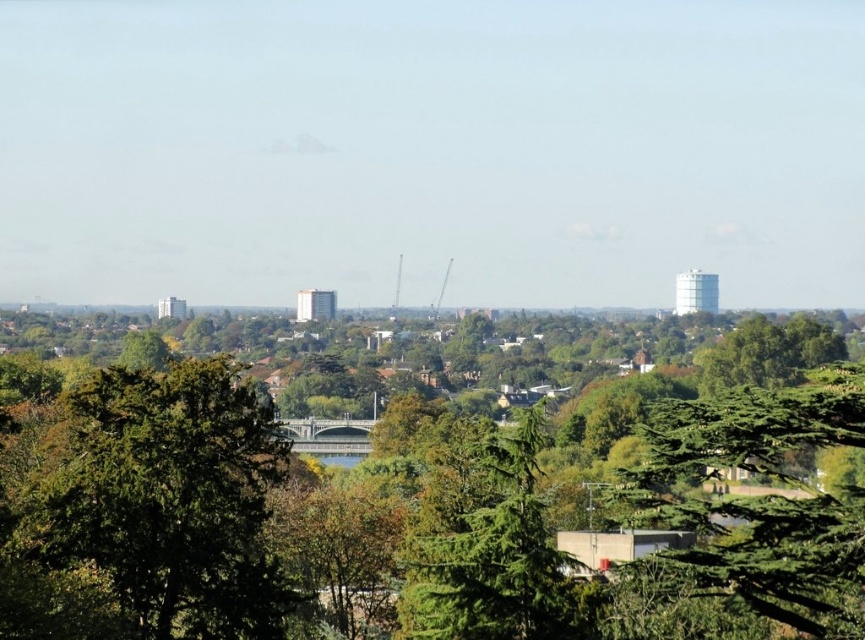
Between green textured tree at lower right and green textured tree at center, which one is positioned higher?

green textured tree at lower right

Is green textured tree at lower right positioned behind green textured tree at center?

Yes, green textured tree at lower right is behind green textured tree at center.

Locate an element on the screen. green textured tree at lower right is located at coordinates (761, 499).

Between green leafy tree at center and green textured tree at center, which one appears on the right side from the viewer's perspective?

A: green textured tree at center

Is point (633, 481) behind point (519, 525)?

That is True.

You are a GUI agent. You are given a task and a screenshot of the screen. Output one action in this format:
    pyautogui.click(x=<x>, y=<y>)
    Task: Click on the green leafy tree at center
    
    Given the screenshot: What is the action you would take?
    pyautogui.click(x=349, y=499)

Does green leafy tree at center come behind green textured tree at lower right?

No, it is in front of green textured tree at lower right.

The image size is (865, 640). What are the coordinates of `green leafy tree at center` in the screenshot? It's located at (349, 499).